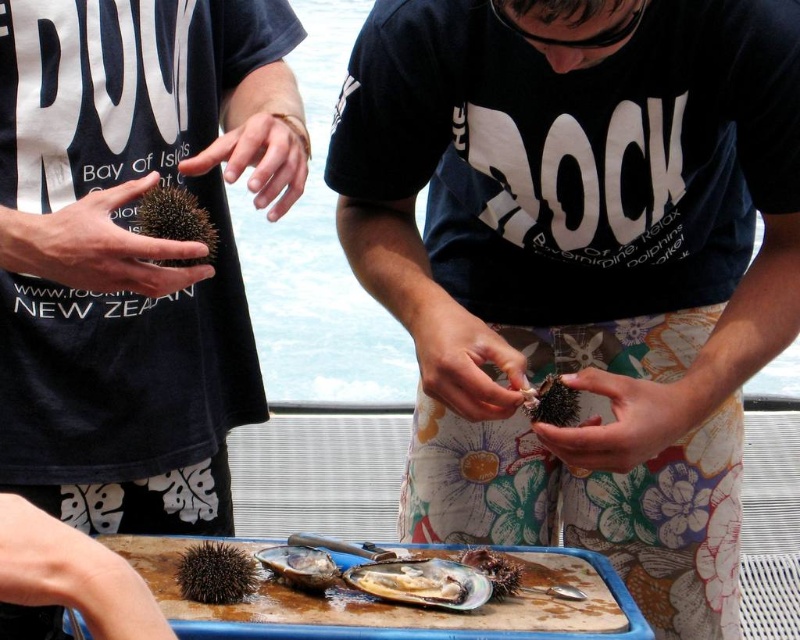
Question: Does matte black hedgehog at left appear on the left side of spiky brown sea urchin at center?

Choices:
 (A) yes
 (B) no

Answer: (A)

Question: Is matte black hedgehog at center to the left of spiky brown sea urchin at center from the viewer's perspective?

Choices:
 (A) yes
 (B) no

Answer: (B)

Question: Which of the following is the farthest from the observer?

Choices:
 (A) matte black hedgehog at left
 (B) matte black hedgehog at center
 (C) shiny pearl oyster at center

Answer: (C)

Question: Which is farther from the shiny silver oyster at center?

Choices:
 (A) matte black hedgehog at center
 (B) shiny pearl oyster at center
 (C) spiky brown sea urchin at center

Answer: (A)

Question: Does matte black hedgehog at left have a lesser width compared to shiny silver oyster at center?

Choices:
 (A) no
 (B) yes

Answer: (A)

Question: Considering the real-world distances, which object is farthest from the shiny pearl oyster at center?

Choices:
 (A) matte black hedgehog at center
 (B) matte black hedgehog at left
 (C) brown spiny at left
 (D) shiny silver oyster at center

Answer: (B)